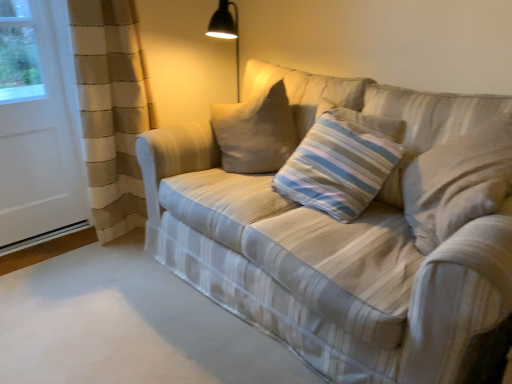
Question: Is striped fabric pillow at center wider or thinner than white matte screen door at left?

Choices:
 (A) wide
 (B) thin

Answer: (A)

Question: From a real-world perspective, relative to white matte screen door at left, is striped fabric pillow at center vertically above or below?

Choices:
 (A) below
 (B) above

Answer: (A)

Question: Which object is the closest to the white matte screen door at left?

Choices:
 (A) striped fabric pillow at center
 (B) plaid fabric couch at center

Answer: (B)

Question: Which object is positioned farthest from the plaid fabric couch at center?

Choices:
 (A) striped fabric pillow at center
 (B) white matte screen door at left

Answer: (B)